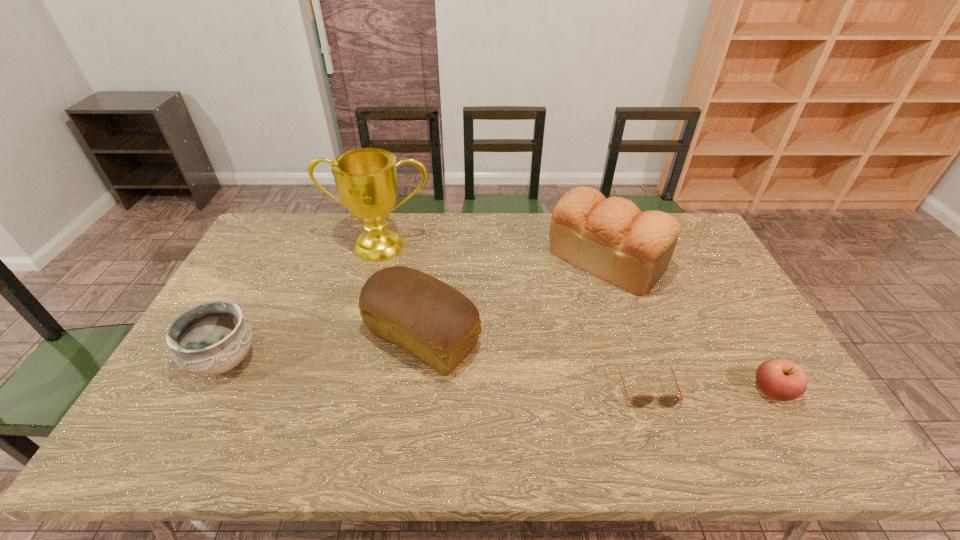
I want to click on vacant space that's between the rightmost object and the left bread, so click(598, 365).

The width and height of the screenshot is (960, 540). In order to click on vacant space that's between the shortest object and the award in this screenshot , I will do `click(513, 315)`.

Locate an element on the screen. The width and height of the screenshot is (960, 540). vacant area that lies between the tallest object and the right bread is located at coordinates (493, 254).

Find the location of a particular element. free space between the tallest object and the fifth tallest object is located at coordinates (577, 319).

This screenshot has height=540, width=960. I want to click on free area in between the sunglasses and the shorter bread, so click(x=534, y=361).

Point out which object is positioned as the second nearest to the sunglasses. Please provide its 2D coordinates. Your answer should be formatted as a tuple, i.e. [(x, y)], where the tuple contains the x and y coordinates of a point satisfying the conditions above.

[(611, 238)]

Image resolution: width=960 pixels, height=540 pixels. I want to click on object that is the fifth nearest to the third shortest object, so click(782, 380).

This screenshot has width=960, height=540. I want to click on vacant space that satisfies the following two spatial constraints: 1. on the front side of the nearer bread; 2. on the left side of the rightmost object, so click(416, 392).

Locate an element on the screen. This screenshot has width=960, height=540. free location that satisfies the following two spatial constraints: 1. on the front-facing side of the rightmost object; 2. on the right side of the shortest object is located at coordinates (647, 392).

Where is `free space that satisfies the following two spatial constraints: 1. on the front-facing side of the shortest object; 2. on the right side of the rightmost object`? The image size is (960, 540). free space that satisfies the following two spatial constraints: 1. on the front-facing side of the shortest object; 2. on the right side of the rightmost object is located at coordinates (647, 392).